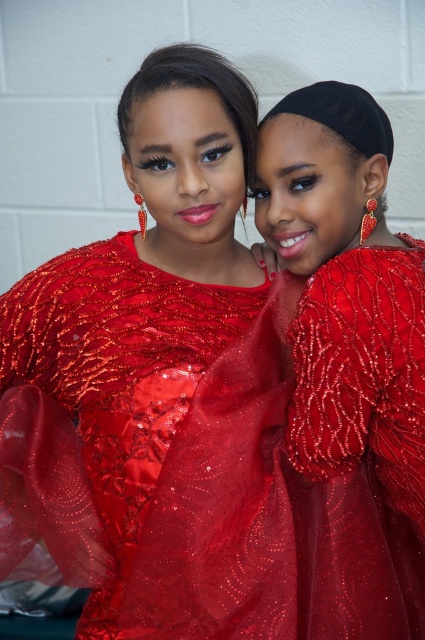
Question: Which point is closer to the camera?

Choices:
 (A) (300, 442)
 (B) (220, 154)

Answer: (A)

Question: Which of the following is the closest to the observer?

Choices:
 (A) beaded silk dress at center
 (B) shiny sequined dress at center

Answer: (B)

Question: Is the position of shiny sequined dress at center more distant than that of beaded silk dress at center?

Choices:
 (A) yes
 (B) no

Answer: (B)

Question: Does shiny sequined dress at center appear on the right side of beaded silk dress at center?

Choices:
 (A) yes
 (B) no

Answer: (B)

Question: Considering the relative positions of shiny sequined dress at center and beaded silk dress at center in the image provided, where is shiny sequined dress at center located with respect to beaded silk dress at center?

Choices:
 (A) below
 (B) above

Answer: (B)